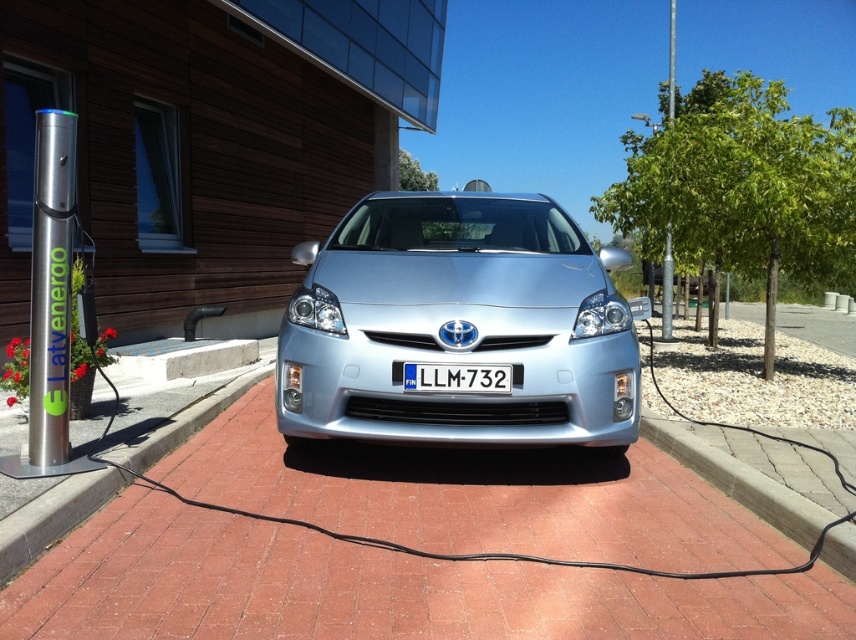
Question: Does silver brick pavement at center appear under brick at lower center?

Choices:
 (A) no
 (B) yes

Answer: (B)

Question: Is silver brick pavement at center to the right of brick at lower center from the viewer's perspective?

Choices:
 (A) no
 (B) yes

Answer: (A)

Question: Does silver brick pavement at center appear on the right side of silver metallic pole at left?

Choices:
 (A) no
 (B) yes

Answer: (B)

Question: Estimate the real-world distances between objects in this image. Which object is closer to the silver metallic pole at left?

Choices:
 (A) brick at lower left
 (B) brick at lower center
 (C) silver brick pavement at center

Answer: (A)

Question: Among these objects, which one is farthest from the camera?

Choices:
 (A) brick at lower center
 (B) white plastic license plate at center
 (C) satin silver car at center
 (D) brick at lower left

Answer: (C)

Question: Which of the following is the closest to the observer?

Choices:
 (A) white plastic license plate at center
 (B) brick at lower left
 (C) silver brick pavement at center
 (D) silver metallic pole at left

Answer: (C)